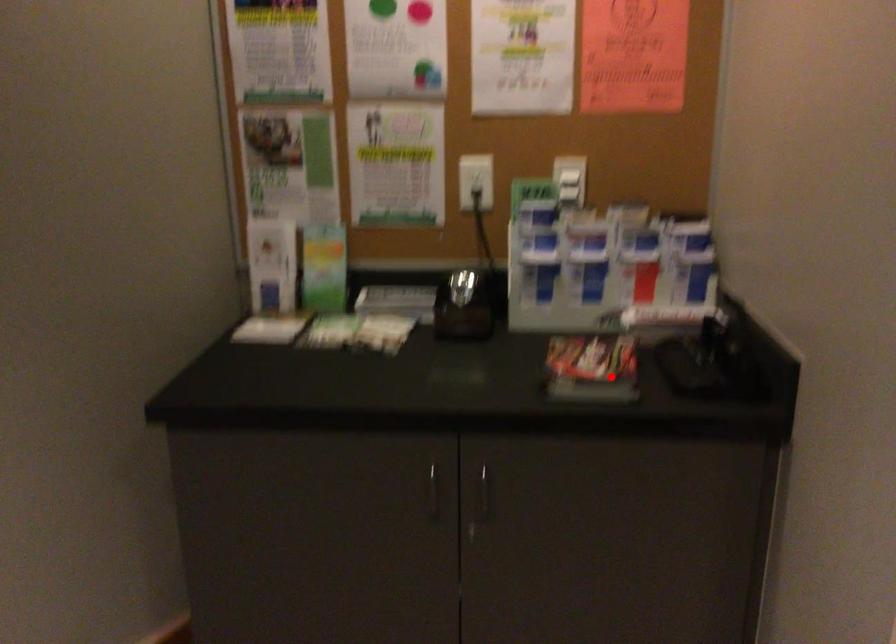
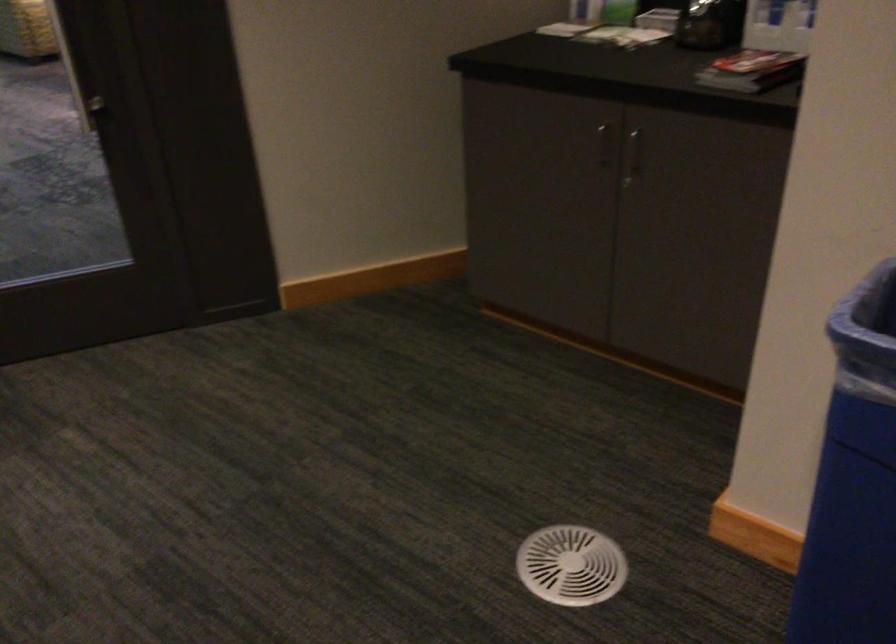
In the second image, find the point that corresponds to the highlighted location in the first image.

(751, 71)